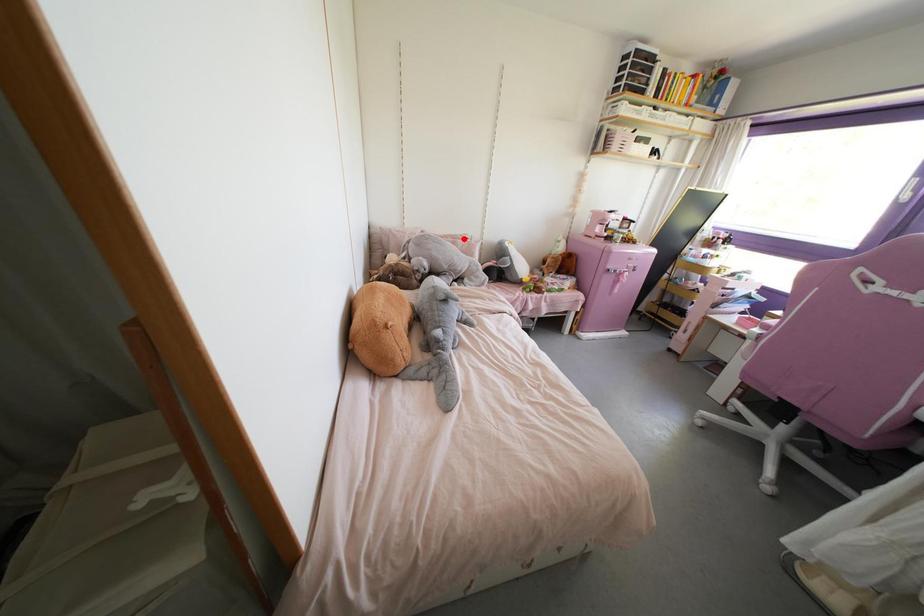
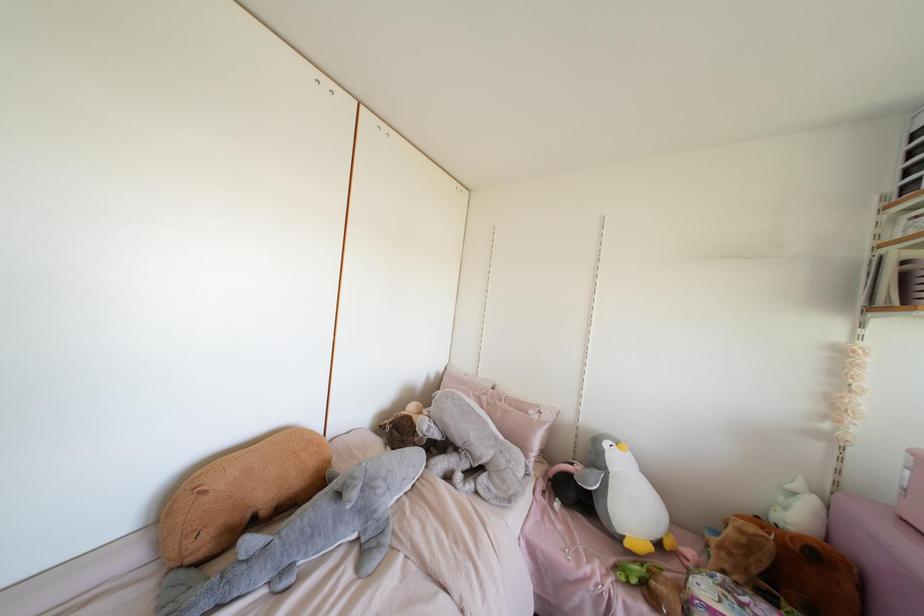
Where in the second image is the point corresponding to the highlighted location from the first image?

(530, 411)